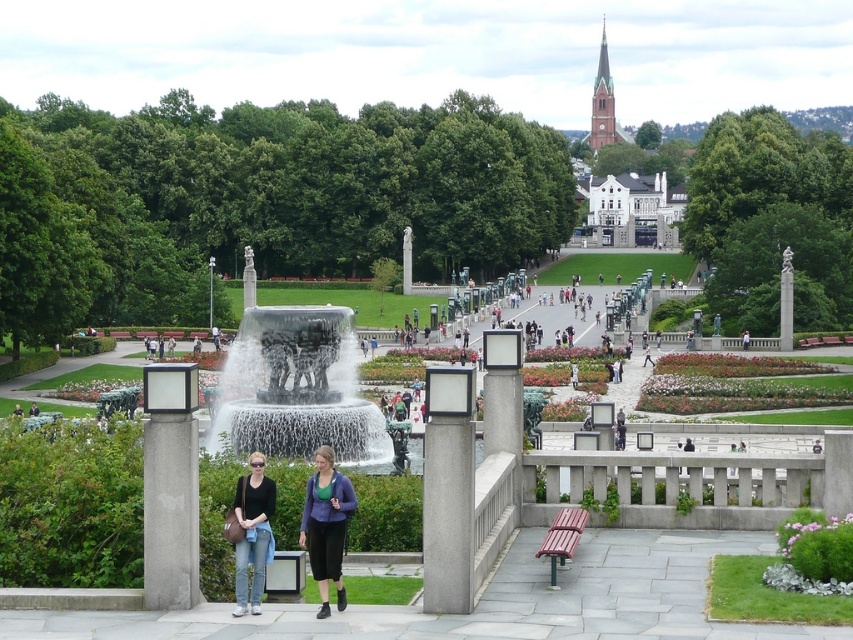
The height and width of the screenshot is (640, 853). Describe the element at coordinates (619, 486) in the screenshot. I see `smooth concrete fountain at center` at that location.

Is smooth concrete fountain at center wider than wooden bench at lower center?

Correct, the width of smooth concrete fountain at center exceeds that of wooden bench at lower center.

In order to click on smooth concrete fountain at center in this screenshot , I will do click(x=619, y=486).

Where is `smooth concrete fountain at center`? smooth concrete fountain at center is located at coordinates (619, 486).

Does matte black jacket at center have a lesser width compared to denim jeans at lower left?

Yes.

Which of these two, matte black jacket at center or denim jeans at lower left, stands shorter?

A: matte black jacket at center is shorter.

Where is `matte black jacket at center`? This screenshot has height=640, width=853. matte black jacket at center is located at coordinates (326, 524).

Does smooth concrete fountain at center have a lesser height compared to matte purple sweater at center?

No.

Who is positioned more to the left, smooth concrete fountain at center or matte purple sweater at center?

matte purple sweater at center

Is point (780, 493) farther from camera compared to point (320, 493)?

Yes.

This screenshot has height=640, width=853. Find the location of `smooth concrete fountain at center`. smooth concrete fountain at center is located at coordinates (619, 486).